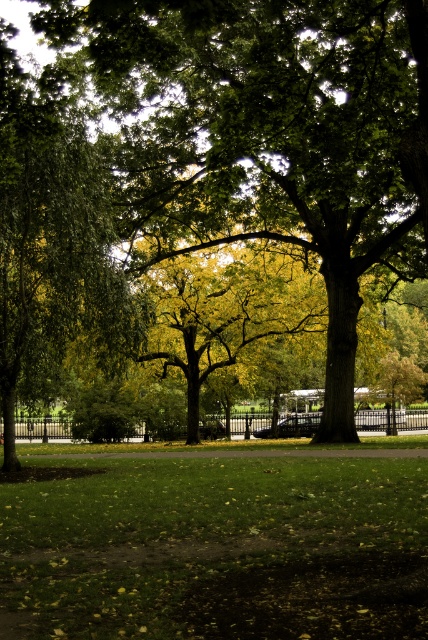
Question: Which object appears farthest from the camera in this image?

Choices:
 (A) green leafy tree at center
 (B) green grass at center

Answer: (A)

Question: Observing the image, what is the correct spatial positioning of green leafy tree at center in reference to green grass at center?

Choices:
 (A) left
 (B) right

Answer: (B)

Question: Is green leafy tree at center above green grass at center?

Choices:
 (A) no
 (B) yes

Answer: (B)

Question: Is green leafy tree at center to the right of green grass at center from the viewer's perspective?

Choices:
 (A) yes
 (B) no

Answer: (A)